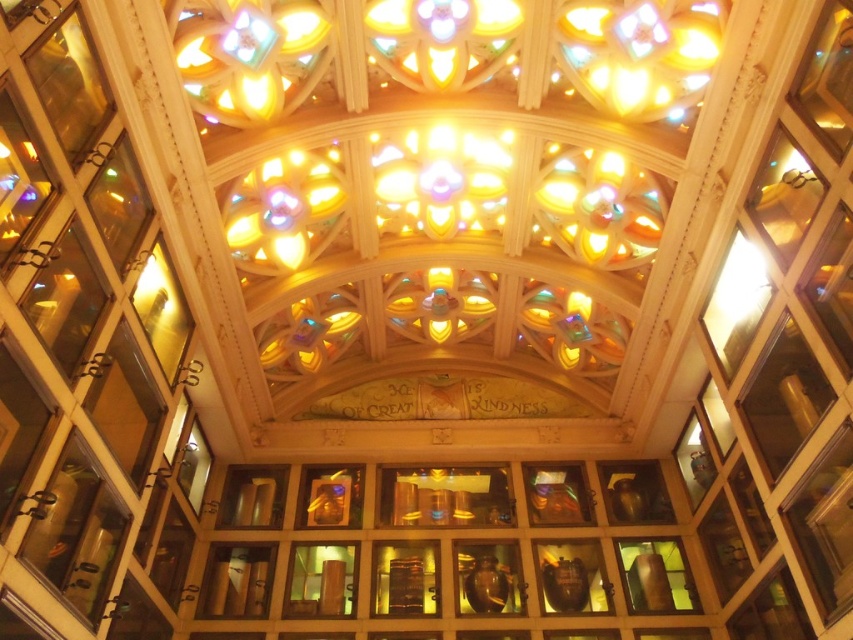
Question: Does transparent glass at center appear over clear glass at left?

Choices:
 (A) yes
 (B) no

Answer: (B)

Question: Considering the relative positions of transparent glass window at upper left and transparent glass vase at lower right in the image provided, where is transparent glass window at upper left located with respect to transparent glass vase at lower right?

Choices:
 (A) below
 (B) above

Answer: (B)

Question: Which point is closer to the camera?

Choices:
 (A) (32, 301)
 (B) (634, 556)
 (C) (717, 349)

Answer: (A)

Question: Is transparent glass cabinet at right positioned behind transparent glass vase at lower right?

Choices:
 (A) no
 (B) yes

Answer: (A)

Question: Among these objects, which one is farthest from the camera?

Choices:
 (A) clear glass window at upper left
 (B) transparent glass at center
 (C) transparent glass vase at lower right

Answer: (B)

Question: Which of the following is the farthest from the observer?

Choices:
 (A) (135, 243)
 (B) (30, 76)
 (C) (67, 257)

Answer: (A)